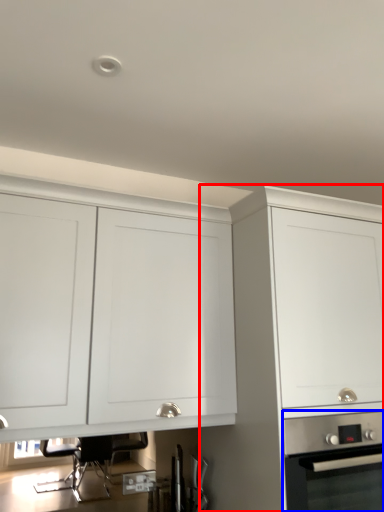
Question: Which object appears closest to the camera in this image, cabinetry (highlighted by a red box) or home appliance (highlighted by a blue box)?

Choices:
 (A) cabinetry
 (B) home appliance

Answer: (A)